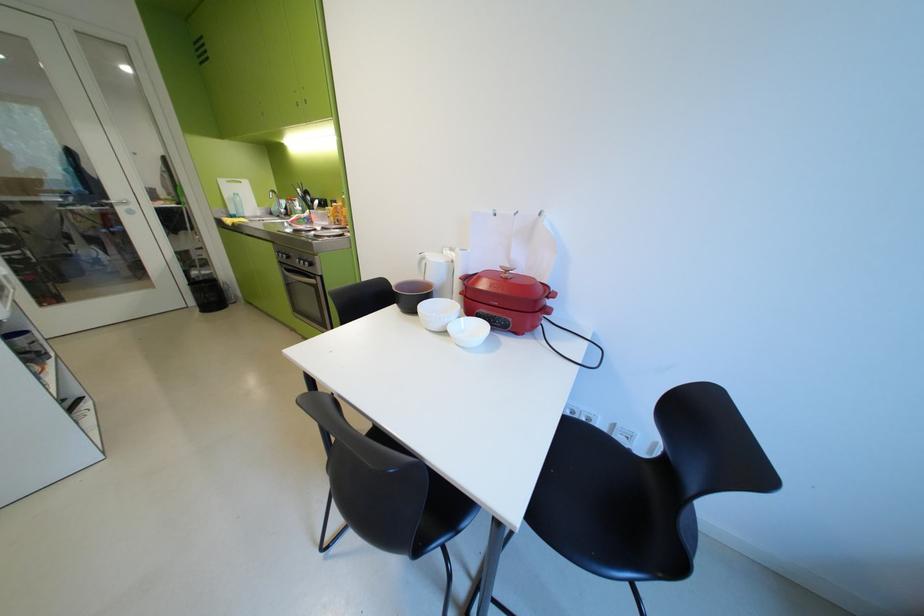
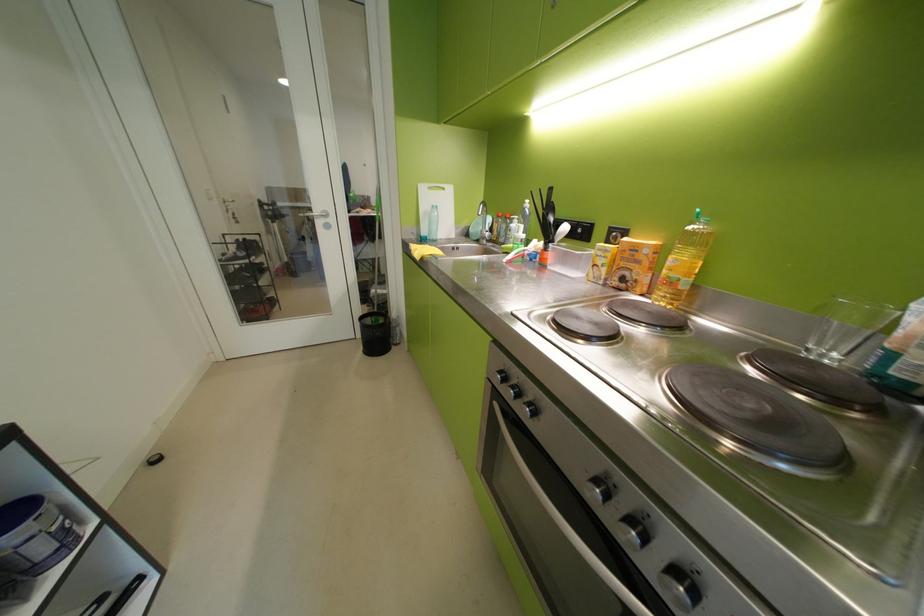
In the second image, find the point that corresponds to point (202, 302) in the first image.

(370, 336)